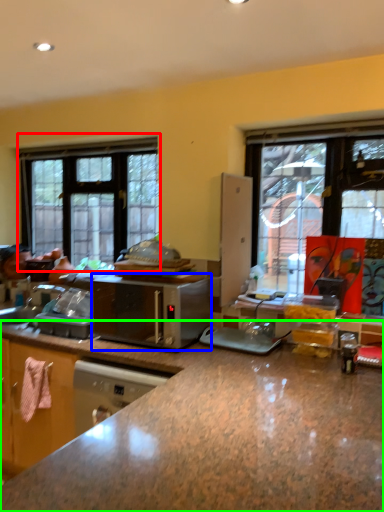
Question: Considering the real-world distances, which object is closest to window (highlighted by a red box)? microwave oven (highlighted by a blue box) or countertop (highlighted by a green box).

Choices:
 (A) microwave oven
 (B) countertop

Answer: (A)